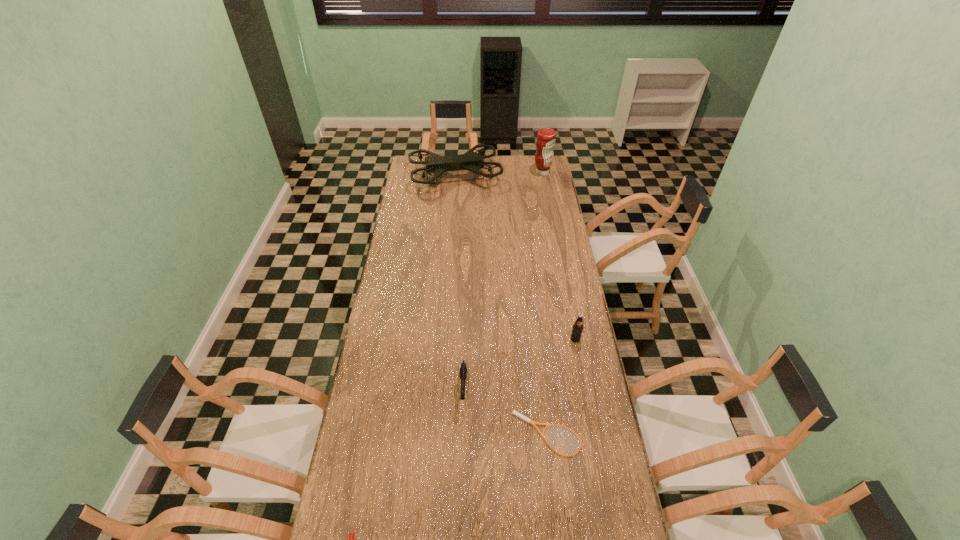
Locate which object ranks second in proximity to the right tennis racket. Please provide its 2D coordinates. Your answer should be formatted as a tuple, i.e. [(x, y)], where the tuple contains the x and y coordinates of a point satisfying the conditions above.

[(577, 329)]

At what (x,y) coordinates should I click in order to perform the action: click on free space that satisfies the following two spatial constraints: 1. on the back side of the condiment; 2. on the right side of the drone. Please return your answer as a coordinate pair (x, y). This screenshot has width=960, height=540. Looking at the image, I should click on (455, 173).